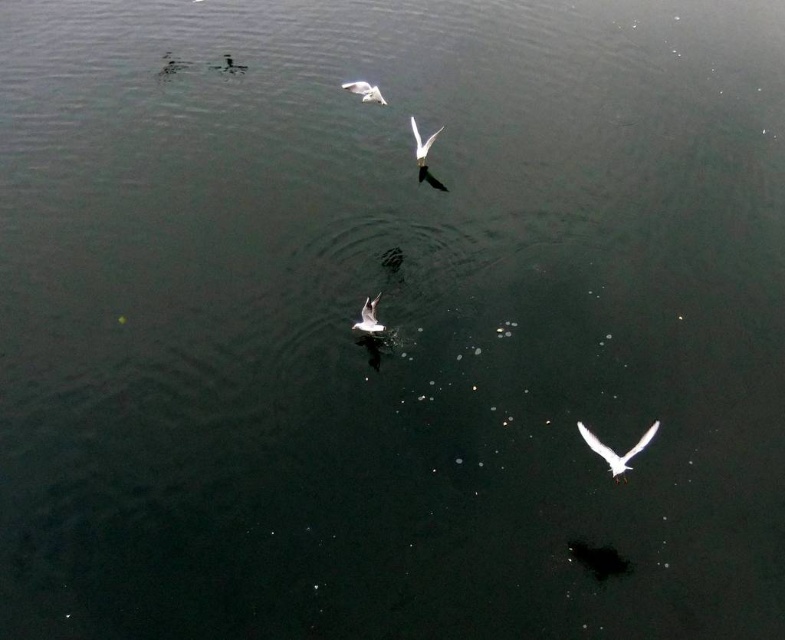
Question: Can you confirm if white glossy bird at lower right is positioned to the left of white glossy bird at center?

Choices:
 (A) no
 (B) yes

Answer: (A)

Question: Is white matte bird at upper center below white matte bird at upper left?

Choices:
 (A) yes
 (B) no

Answer: (A)

Question: Which of these objects is positioned closest to the white glossy bird at center?

Choices:
 (A) white matte bird at upper left
 (B) white glossy bird at lower right
 (C) white matte bird at upper center

Answer: (C)

Question: Considering the real-world distances, which object is closest to the white matte bird at center?

Choices:
 (A) white glossy bird at center
 (B) white glossy bird at lower right
 (C) white matte bird at upper center
 (D) white matte bird at upper left

Answer: (B)

Question: Can you confirm if white glossy bird at lower right is positioned to the left of white matte bird at upper left?

Choices:
 (A) yes
 (B) no

Answer: (B)

Question: Which of the following is the farthest from the observer?

Choices:
 (A) (369, 88)
 (B) (371, 301)
 (C) (223, 54)
 (D) (433, 141)

Answer: (C)